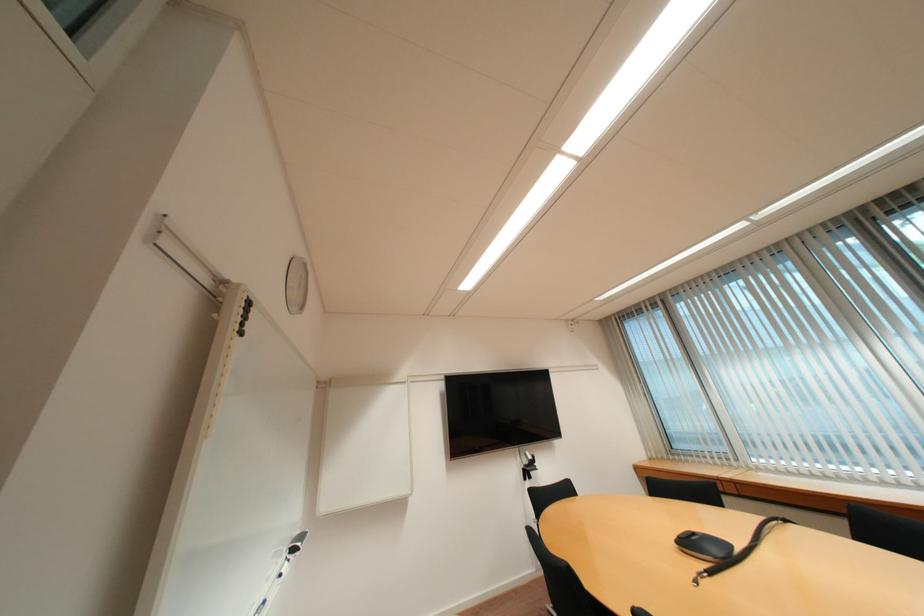
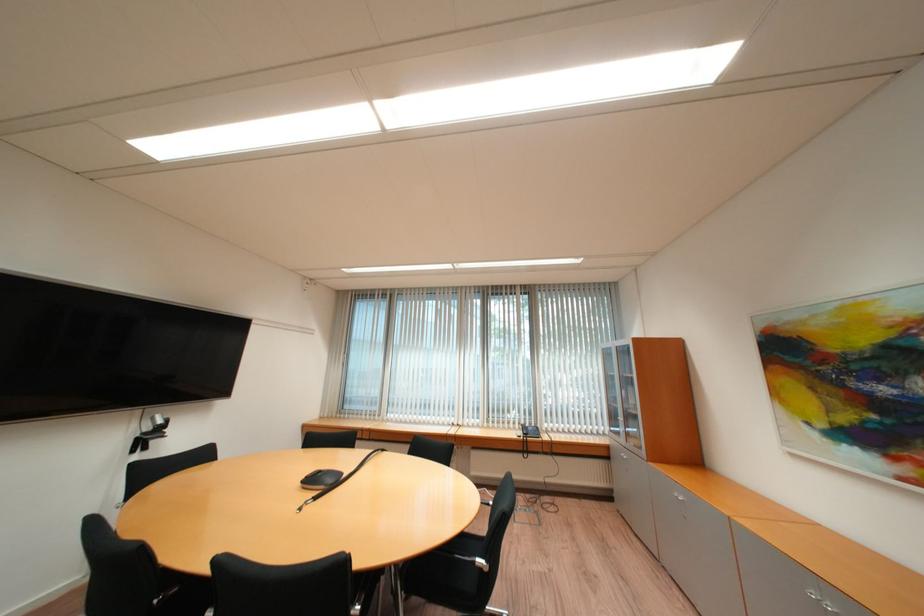
The point at (x=697, y=544) is marked in the first image. Where is the corresponding point in the second image?

(320, 482)